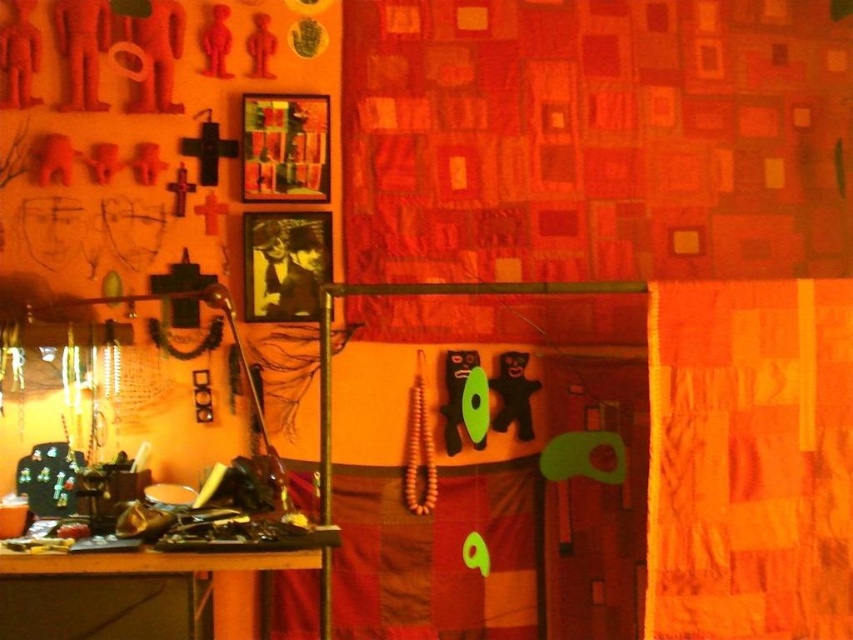
You are organizing a small art exhibition in the studio and need to place a new sculpture. The sculpture is 1.2 meters wide. There is a space between the orange quilted curtain at upper right and the wooden table at lower left. Can the sculpture fit in that space horizontally?

The orange quilted curtain at upper right is positioned on the right side of wooden table at lower left, but the exact distance between them isn not provided. Therefore, it is uncertain if the sculpture will fit horizontally in that space.

You are an interior designer planning to rearrange the furniture in the studio. You want to ensure that the wooden table at lower left is visible from the entrance. Currently, the orange quilted curtain at upper right is blocking the view. How can you adjust their positions to achieve this?

Move the orange quilted curtain at upper right away from the wooden table at lower left so it no longer blocks the view of the table from the entrance.

From the picture: You are an interior designer planning to hang a new artwork on the wall between the orange quilted curtain at upper right and the wooden table at lower left. Considering their widths, which object should you avoid placing the artwork too close to?

The orange quilted curtain at upper right is thinner than the wooden table at lower left, so you should avoid placing the artwork too close to the orange quilted curtain at upper right to ensure proper spacing.